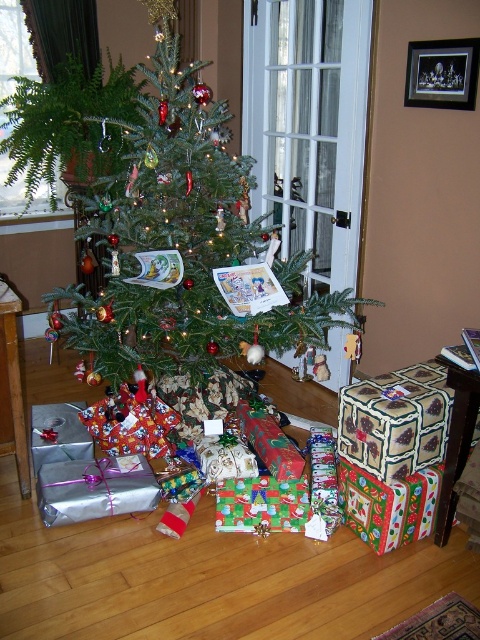
Measure the distance from green matte christmas tree at center to green leafy plant at upper left.

The distance of green matte christmas tree at center from green leafy plant at upper left is 24.17 inches.

Is green matte christmas tree at center shorter than green leafy plant at upper left?

No.

Which is in front, point (330, 141) or point (79, 90)?

Point (330, 141) is in front.

Where is `green matte christmas tree at center`? The height and width of the screenshot is (640, 480). green matte christmas tree at center is located at coordinates (197, 240).